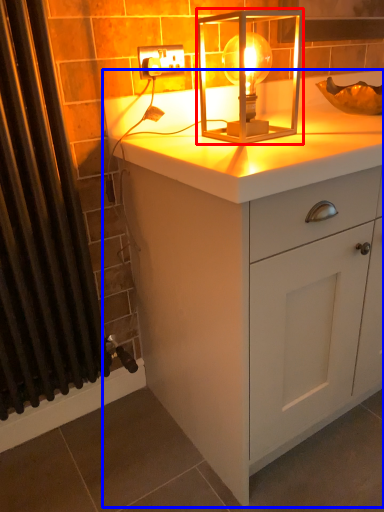
Question: Which of the following is the closest to the observer, lamp (highlighted by a red box) or chest of drawers (highlighted by a blue box)?

Choices:
 (A) lamp
 (B) chest of drawers

Answer: (B)